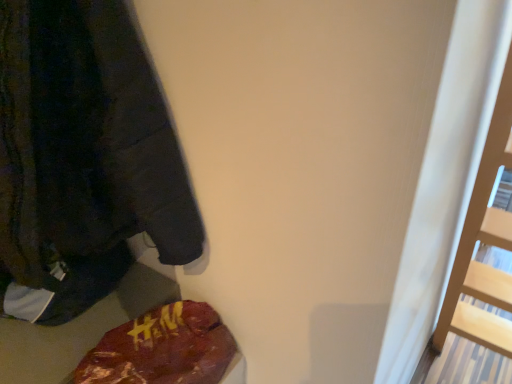
You are a GUI agent. You are given a task and a screenshot of the screen. Output one action in this format:
    pyautogui.click(x=<x>, y=<y>)
    Task: Click on the maroon fabric bag at lower left
    This screenshot has height=384, width=512.
    Given the screenshot: What is the action you would take?
    pyautogui.click(x=162, y=349)

The width and height of the screenshot is (512, 384). Describe the element at coordinates (162, 349) in the screenshot. I see `maroon fabric bag at lower left` at that location.

The width and height of the screenshot is (512, 384). Describe the element at coordinates (83, 158) in the screenshot. I see `dark gray fleece sweatshirt at left` at that location.

The height and width of the screenshot is (384, 512). What are the coordinates of `dark gray fleece sweatshirt at left` in the screenshot? It's located at (83, 158).

Find the location of a particular element. The image size is (512, 384). maroon fabric bag at lower left is located at coordinates (162, 349).

Considering the relative positions of maroon fabric bag at lower left and dark gray fleece sweatshirt at left in the image provided, is maroon fabric bag at lower left to the right of dark gray fleece sweatshirt at left from the viewer's perspective?

Yes, maroon fabric bag at lower left is to the right of dark gray fleece sweatshirt at left.

From the picture: Does maroon fabric bag at lower left lie behind dark gray fleece sweatshirt at left?

Yes, it is behind dark gray fleece sweatshirt at left.

Is point (77, 374) in front of point (141, 144)?

No, (77, 374) is behind (141, 144).

From the image's perspective, is maroon fabric bag at lower left located beneath dark gray fleece sweatshirt at left?

Yes.

From a real-world perspective, is maroon fabric bag at lower left located higher than dark gray fleece sweatshirt at left?

Incorrect, from a real-world perspective, maroon fabric bag at lower left is lower than dark gray fleece sweatshirt at left.

Does maroon fabric bag at lower left have a greater width compared to dark gray fleece sweatshirt at left?

In fact, maroon fabric bag at lower left might be narrower than dark gray fleece sweatshirt at left.

Between maroon fabric bag at lower left and dark gray fleece sweatshirt at left, which one has more height?

dark gray fleece sweatshirt at left is taller.

Does maroon fabric bag at lower left have a smaller size compared to dark gray fleece sweatshirt at left?

Yes, maroon fabric bag at lower left is smaller than dark gray fleece sweatshirt at left.

Is maroon fabric bag at lower left inside or outside of dark gray fleece sweatshirt at left?

maroon fabric bag at lower left is located beyond the bounds of dark gray fleece sweatshirt at left.

Is there a large distance between maroon fabric bag at lower left and dark gray fleece sweatshirt at left?

They are positioned close to each other.

Is maroon fabric bag at lower left looking in the opposite direction of dark gray fleece sweatshirt at left?

maroon fabric bag at lower left is not turned away from dark gray fleece sweatshirt at left.

You are a GUI agent. You are given a task and a screenshot of the screen. Output one action in this format:
    pyautogui.click(x=<x>, y=<y>)
    Task: Click on the sweatshirt on the left of maroon fabric bag at lower left
    
    Given the screenshot: What is the action you would take?
    pyautogui.click(x=83, y=158)

Looking at this image, between dark gray fleece sweatshirt at left and maroon fabric bag at lower left, which one appears on the left side from the viewer's perspective?

dark gray fleece sweatshirt at left.

Is dark gray fleece sweatshirt at left behind maroon fabric bag at lower left?

That is False.

Considering the positions of points (147, 151) and (160, 326), is point (147, 151) closer to camera compared to point (160, 326)?

Yes, it is in front of point (160, 326).

From the image's perspective, is dark gray fleece sweatshirt at left above or below maroon fabric bag at lower left?

Based on their image positions, dark gray fleece sweatshirt at left is located above maroon fabric bag at lower left.

From a real-world perspective, which object stands above the other?

dark gray fleece sweatshirt at left is physically above.

Considering the relative sizes of dark gray fleece sweatshirt at left and maroon fabric bag at lower left in the image provided, is dark gray fleece sweatshirt at left wider than maroon fabric bag at lower left?

Yes, dark gray fleece sweatshirt at left is wider than maroon fabric bag at lower left.

Can you confirm if dark gray fleece sweatshirt at left is shorter than maroon fabric bag at lower left?

In fact, dark gray fleece sweatshirt at left may be taller than maroon fabric bag at lower left.

Considering the sizes of objects dark gray fleece sweatshirt at left and maroon fabric bag at lower left in the image provided, who is smaller, dark gray fleece sweatshirt at left or maroon fabric bag at lower left?

maroon fabric bag at lower left is smaller.

From the picture: Can maroon fabric bag at lower left be found inside dark gray fleece sweatshirt at left?

No, maroon fabric bag at lower left is not a part of dark gray fleece sweatshirt at left.

Are dark gray fleece sweatshirt at left and maroon fabric bag at lower left far apart?

They are positioned close to each other.

Is dark gray fleece sweatshirt at left oriented away from maroon fabric bag at lower left?

dark gray fleece sweatshirt at left is not turned away from maroon fabric bag at lower left.

Where is `sweatshirt lying in front of the maroon fabric bag at lower left`? The image size is (512, 384). sweatshirt lying in front of the maroon fabric bag at lower left is located at coordinates (83, 158).

At what (x,y) coordinates should I click in order to perform the action: click on sweatshirt that is in front of the maroon fabric bag at lower left. Please return your answer as a coordinate pair (x, y). The width and height of the screenshot is (512, 384). Looking at the image, I should click on (83, 158).

Locate an element on the screen. food that is on the right side of dark gray fleece sweatshirt at left is located at coordinates (162, 349).